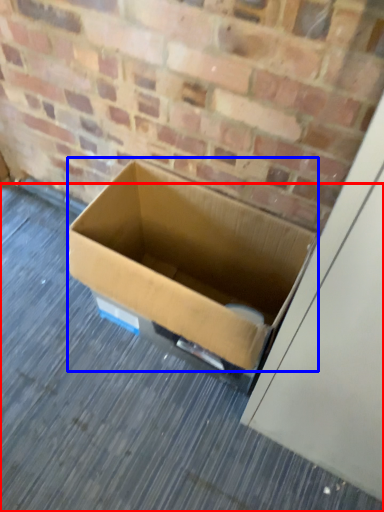
Question: Which point is closer to the camera, alley (highlighted by a red box) or box (highlighted by a blue box)?

Choices:
 (A) alley
 (B) box

Answer: (B)